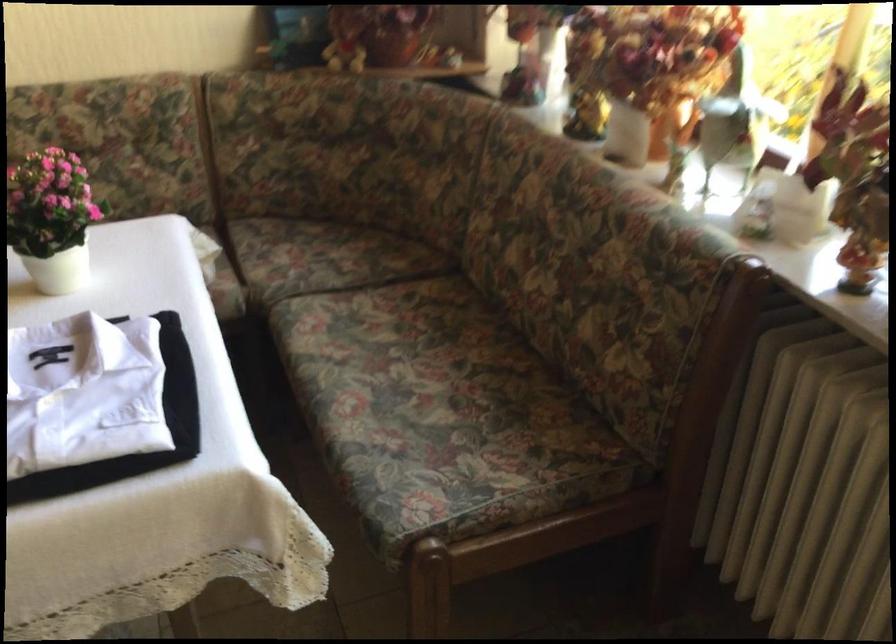
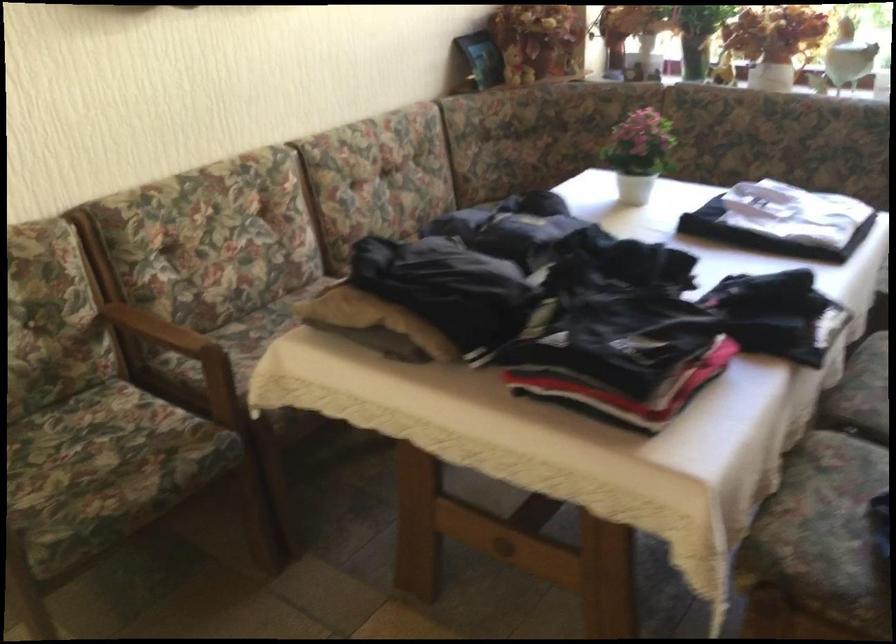
Question: I am providing you with two images of the same scene from different viewpoints. Please identify which objects are invisible in image2.

Choices:
 (A) white flower pot
 (B) teal vr headset
 (C) wooden chair armrest
 (D) floral sofa sitting surface

Answer: (D)